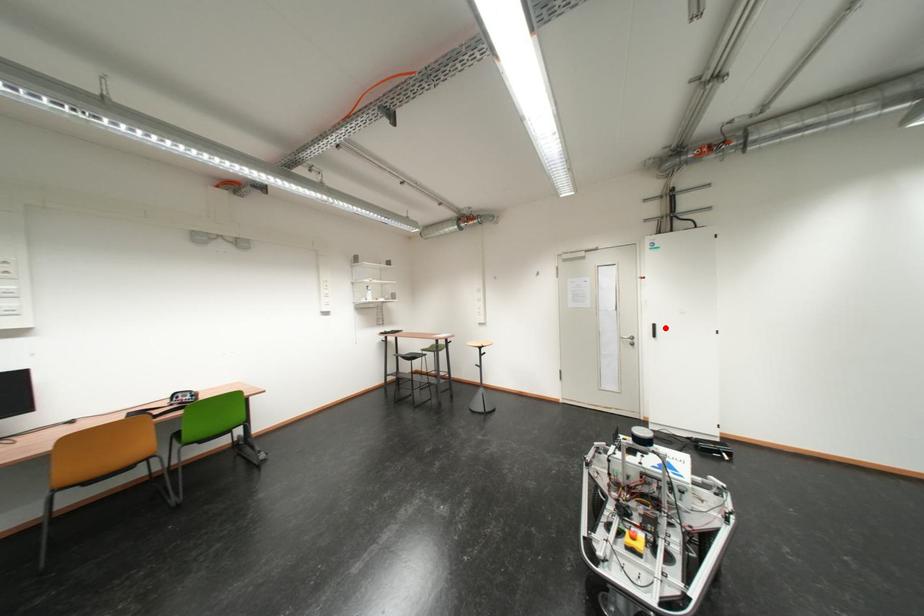
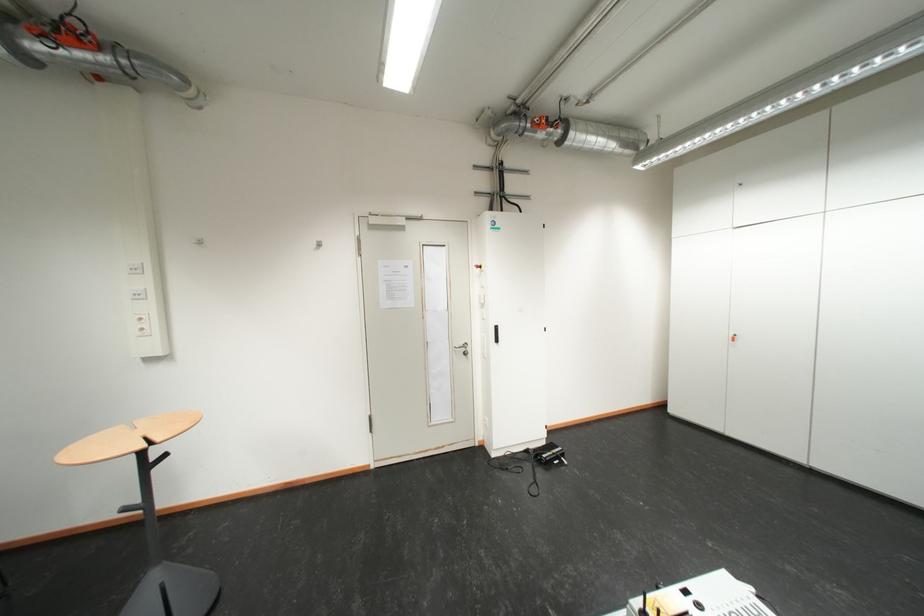
Question: I am providing you with two images of the same scene from different viewpoints. A red point is shown in image1. For the corresponding object point in image2, is it positioned nearer or farther from the camera?

Choices:
 (A) Nearer
 (B) Farther

Answer: (B)